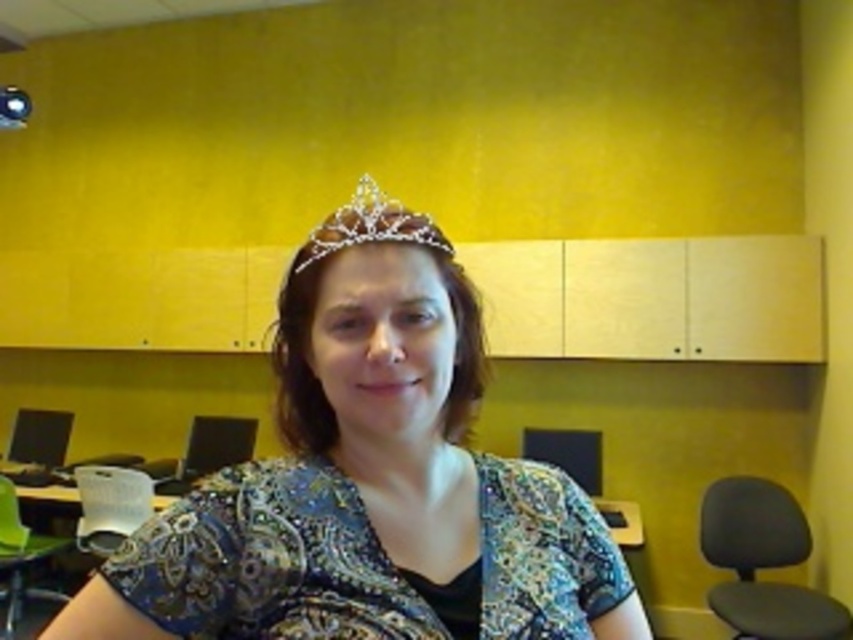
Question: Is shiny sequined dress at center below white plastic chair at lower left?

Choices:
 (A) yes
 (B) no

Answer: (B)

Question: Which point is closer to the camera?

Choices:
 (A) green fabric chair at lower left
 (B) clear crystal tiara at center

Answer: (A)

Question: Which point is farther to the camera?

Choices:
 (A) (799, 532)
 (B) (308, 260)
 (C) (84, 493)

Answer: (C)

Question: Which of these objects is positioned closest to the black fabric swivel chair at lower right?

Choices:
 (A) green fabric chair at lower left
 (B) clear crystal tiara at center

Answer: (B)

Question: Can you confirm if sparkly blue dress at center is positioned below shiny sequined dress at center?

Choices:
 (A) no
 (B) yes

Answer: (A)

Question: In this image, where is sparkly blue dress at center located relative to clear crystal tiara at center?

Choices:
 (A) above
 (B) below

Answer: (B)